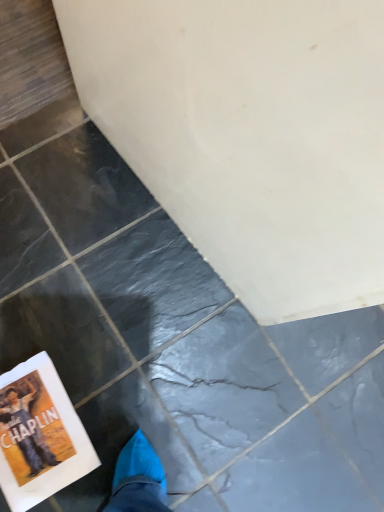
In order to face white paper at lower left, should I rotate leftwards or rightwards?

A 20.418 degree turn to the left will do.

At what (x,y) coordinates should I click in order to perform the action: click on white paper at lower left. Please return your answer as a coordinate pair (x, y). This screenshot has width=384, height=512. Looking at the image, I should click on (40, 435).

What do you see at coordinates (40, 435) in the screenshot?
I see `white paper at lower left` at bounding box center [40, 435].

You are a GUI agent. You are given a task and a screenshot of the screen. Output one action in this format:
    pyautogui.click(x=<x>, y=<y>)
    Task: Click on the white paper at lower left
    
    Given the screenshot: What is the action you would take?
    pyautogui.click(x=40, y=435)